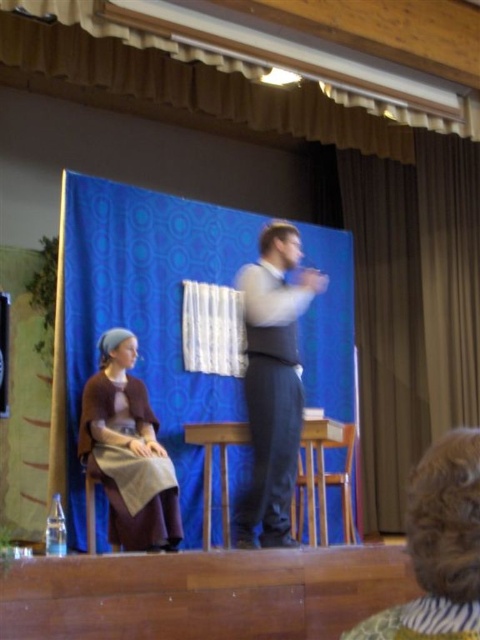
Who is positioned more to the left, wooden stool at center or matte black vest at center?

Positioned to the left is matte black vest at center.

Between wooden stool at center and matte black vest at center, which one has more height?

Standing taller between the two is wooden stool at center.

Between point (315, 445) and point (9, 312), which one is positioned in front?

Point (9, 312) is more forward.

At what (x,y) coordinates should I click in order to perform the action: click on wooden stool at center. Please return your answer as a coordinate pair (x, y). This screenshot has height=640, width=480. Looking at the image, I should click on (320, 468).

In the scene shown: Between light gray fabric vest at center and curly brown hair at lower right, which one is positioned lower?

curly brown hair at lower right is below.

Does point (261, 449) come in front of point (429, 554)?

No.

At what (x,y) coordinates should I click in order to perform the action: click on light gray fabric vest at center. Please return your answer as a coordinate pair (x, y). This screenshot has width=480, height=640. Looking at the image, I should click on (273, 381).

Does point (273, 524) come farther from viewer compared to point (172, 548)?

No, it is in front of (172, 548).

Can you confirm if light gray fabric vest at center is smaller than matte brown dress at left?

Yes.

Who is more forward, (274,456) or (149,465)?

Positioned in front is point (274,456).

Identify the location of light gray fabric vest at center. (273, 381).